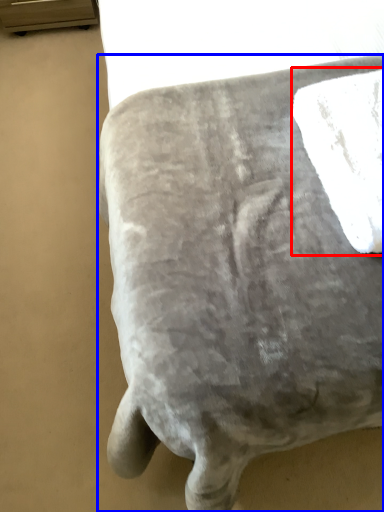
Question: Which of the following is the closest to the observer, bath towel (highlighted by a red box) or furniture (highlighted by a blue box)?

Choices:
 (A) bath towel
 (B) furniture

Answer: (A)